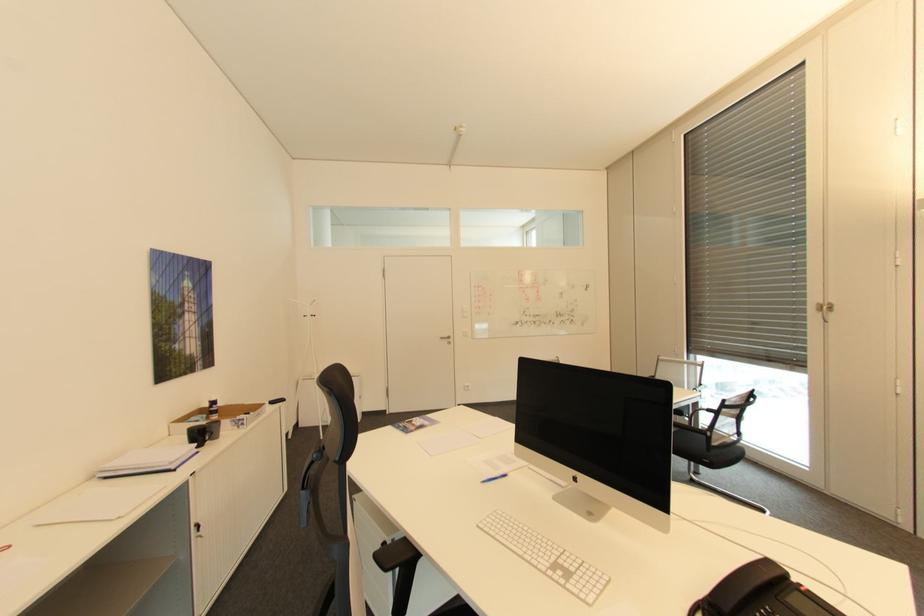
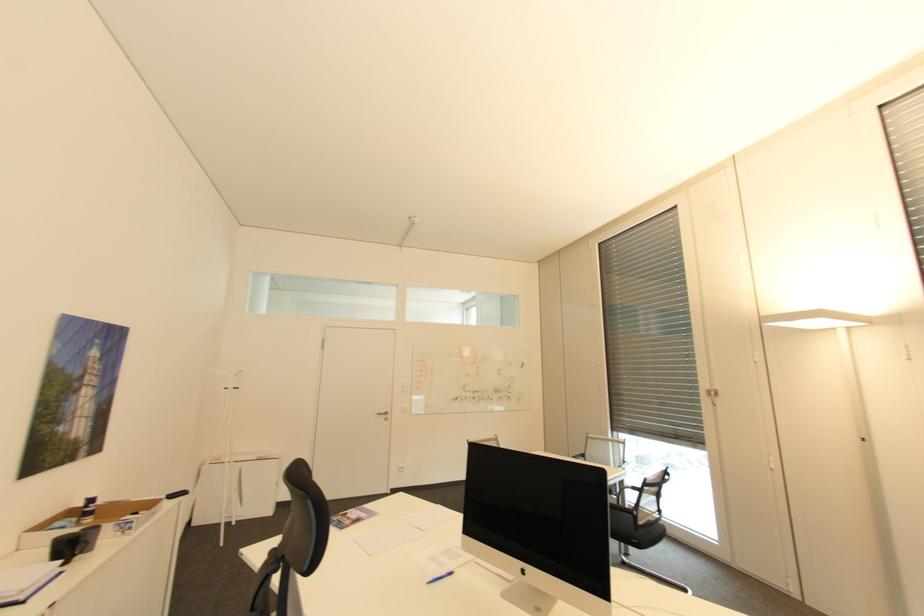
The point at (332, 390) is marked in the first image. Where is the corresponding point in the second image?

(306, 492)